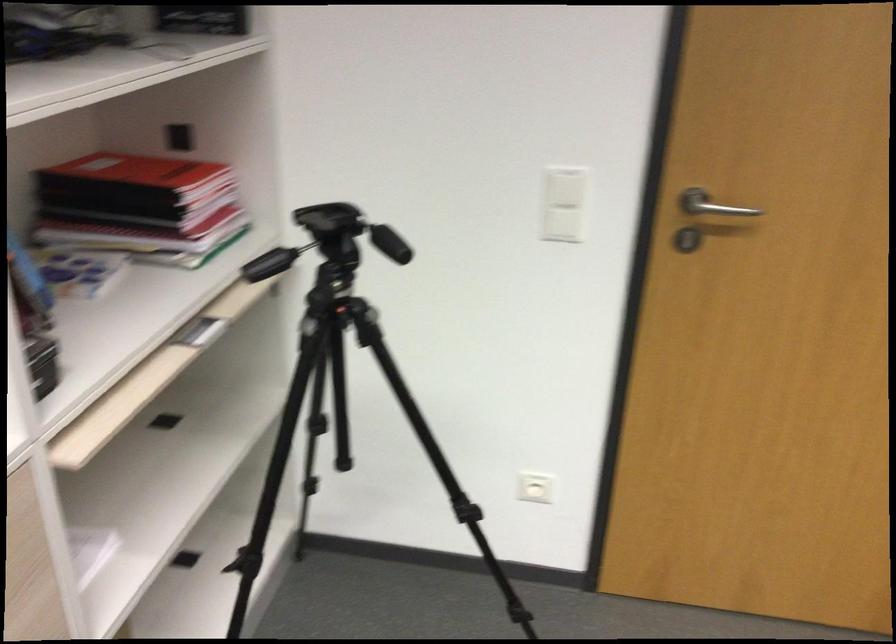
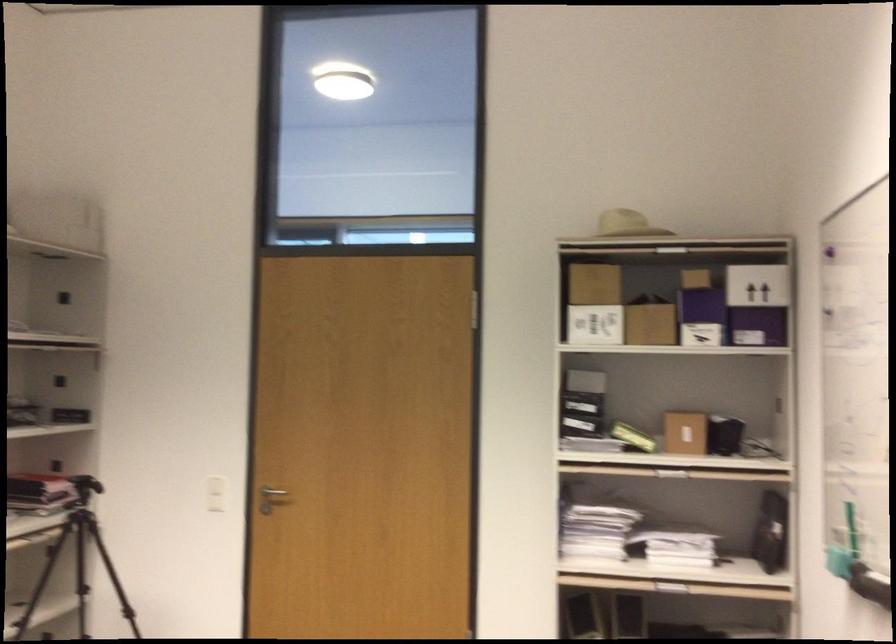
Find the pixel in the second image that matches [547,210] in the first image.

(216, 494)